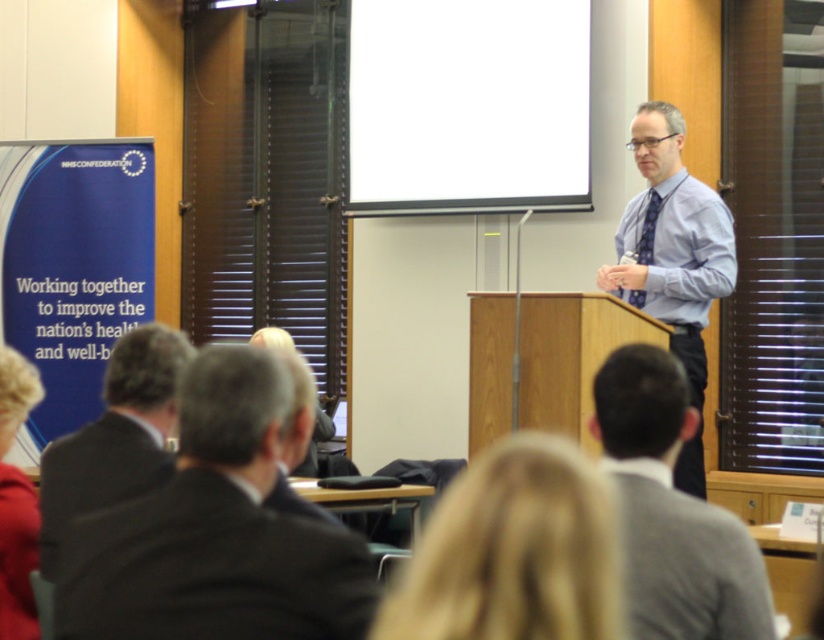
Question: Where is blue shirt at center located in relation to dark gray suit at lower left in the image?

Choices:
 (A) above
 (B) below

Answer: (A)

Question: Is black suit at left closer to the viewer compared to light blue cotton dress shirt at upper right?

Choices:
 (A) no
 (B) yes

Answer: (B)

Question: Considering the relative positions of blonde hair at lower center and dark gray suit at lower left in the image provided, where is blonde hair at lower center located with respect to dark gray suit at lower left?

Choices:
 (A) right
 (B) left

Answer: (A)

Question: Estimate the real-world distances between objects in this image. Which object is closer to the light blue cotton dress shirt at upper right?

Choices:
 (A) blonde hair at lower left
 (B) blue shirt at center

Answer: (B)

Question: Which of these objects is positioned closest to the blue textured tie at center?

Choices:
 (A) dark gray suit at lower left
 (B) black suit at left
 (C) white matte projection screen at upper center
 (D) light blue cotton dress shirt at upper right

Answer: (D)

Question: Which point is closer to the camera?

Choices:
 (A) blonde hair at lower center
 (B) white matte projection screen at upper center
 (C) dark gray suit at lower left
 (D) light blue cotton dress shirt at upper right

Answer: (A)